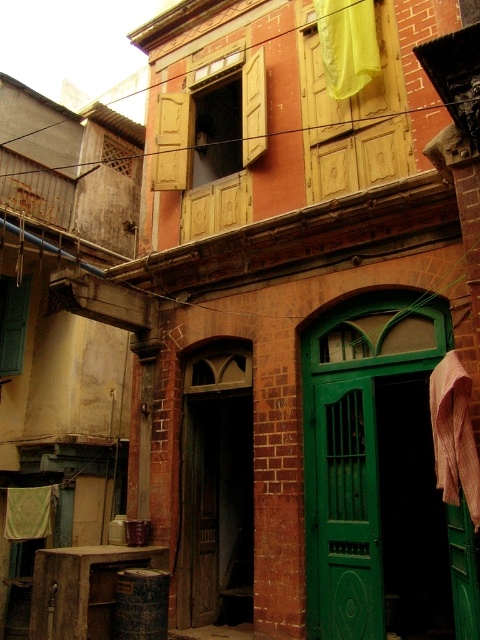
Can you confirm if wooden door at center is bigger than green wooden door at center?

Indeed, wooden door at center has a larger size compared to green wooden door at center.

Is point (226, 493) in front of point (332, 486)?

No, (226, 493) is behind (332, 486).

Locate an element on the screen. The image size is (480, 640). wooden door at center is located at coordinates (216, 512).

Does green wooden door at center have a greater height compared to yellow fabric at upper center?

Yes, green wooden door at center is taller than yellow fabric at upper center.

Which of these two, green wooden door at center or yellow fabric at upper center, stands taller?

With more height is green wooden door at center.

Based on the photo, who is more distant from viewer, (x=330, y=490) or (x=324, y=6)?

The point (x=324, y=6) is behind.

I want to click on green wooden door at center, so click(348, 512).

Can you confirm if wooden door at center is positioned to the left of green fabric laundry at lower left?

In fact, wooden door at center is to the right of green fabric laundry at lower left.

Does point (249, 538) come behind point (49, 509)?

No, (249, 538) is in front of (49, 509).

Does point (196, 435) come farther from viewer compared to point (41, 513)?

No.

Locate an element on the screen. This screenshot has height=640, width=480. wooden door at center is located at coordinates (216, 512).